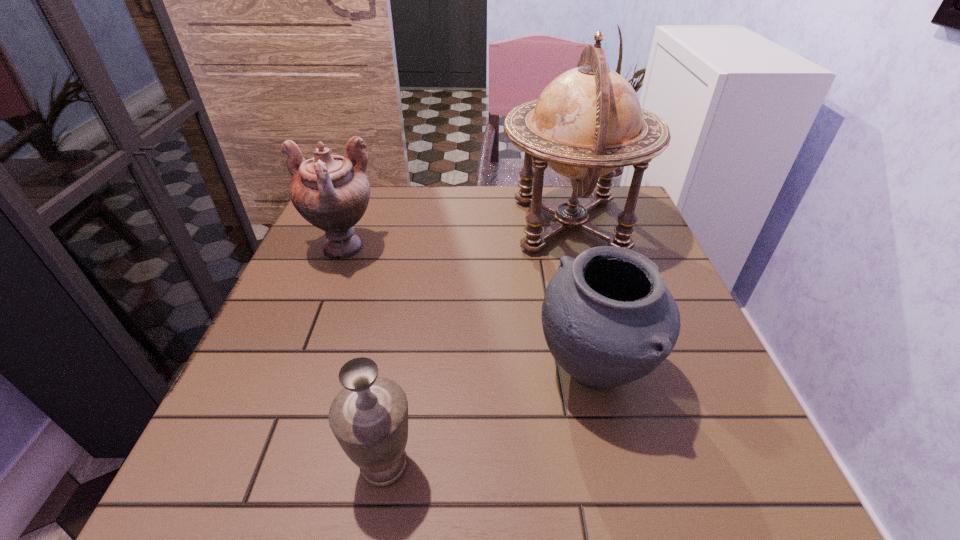
The image size is (960, 540). I want to click on object that is positioned at the far right corner, so click(588, 121).

Locate an element on the screen. This screenshot has height=540, width=960. vacant area at the far edge of the desktop is located at coordinates (444, 227).

Locate an element on the screen. This screenshot has width=960, height=540. free region at the near edge of the desktop is located at coordinates (516, 491).

Identify the location of free point at the left edge. (299, 316).

At what (x,y) coordinates should I click in order to perform the action: click on vacant space at the right edge of the desktop. Please return your answer as a coordinate pair (x, y). This screenshot has width=960, height=540. Looking at the image, I should click on (675, 390).

This screenshot has height=540, width=960. I want to click on vacant position at the far right corner of the desktop, so click(x=585, y=233).

At what (x,y) coordinates should I click in order to perform the action: click on vacant region between the leftmost urn and the rightmost urn. Please return your answer as a coordinate pair (x, y). Looking at the image, I should click on click(x=468, y=309).

What are the coordinates of `vacant area that lies between the nearest urn and the farthest urn` in the screenshot? It's located at (363, 356).

This screenshot has height=540, width=960. I want to click on vacant region between the third farthest object and the leftmost object, so click(468, 309).

The width and height of the screenshot is (960, 540). What are the coordinates of `vacant region between the second nearest object and the farthest urn` in the screenshot? It's located at click(x=468, y=309).